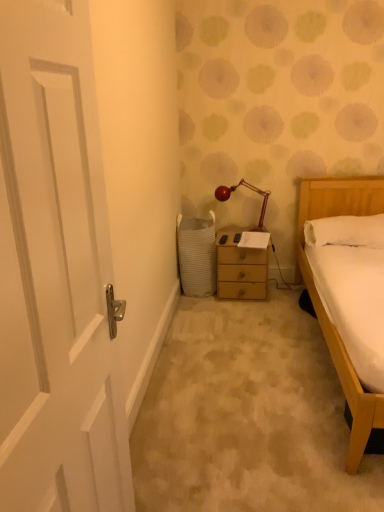
Question: From the image's perspective, is metallic red lamp at center positioned above or below wooden nightstand at center?

Choices:
 (A) below
 (B) above

Answer: (B)

Question: Is point (264, 229) positioned closer to the camera than point (215, 238)?

Choices:
 (A) closer
 (B) farther

Answer: (B)

Question: Which object is the farthest from the wooden nightstand at center?

Choices:
 (A) white soft pillow at right
 (B) metallic red lamp at center
 (C) white glossy door at left
 (D) white woven laundry basket at lower center

Answer: (C)

Question: Based on their relative distances, which object is farther from the wooden nightstand at center?

Choices:
 (A) white woven laundry basket at lower center
 (B) white soft pillow at right
 (C) metallic red lamp at center
 (D) white glossy door at left

Answer: (D)